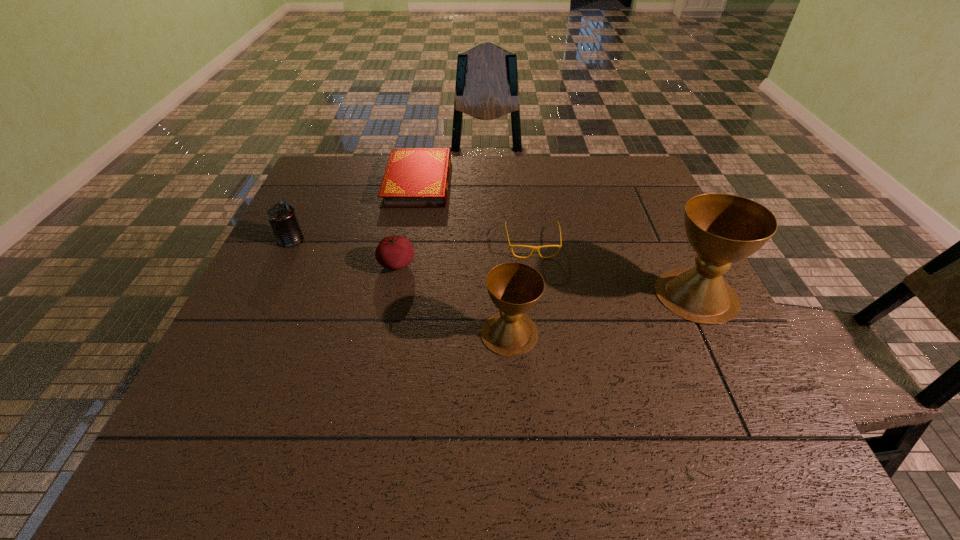
Image resolution: width=960 pixels, height=540 pixels. In the image, there is a desktop. What are the coordinates of `vacant space at the right edge` in the screenshot? It's located at (643, 220).

Find the location of `free location at the far left corner`. free location at the far left corner is located at coordinates (343, 166).

This screenshot has height=540, width=960. I want to click on vacant region at the near left corner of the desktop, so click(x=198, y=389).

Locate an element on the screen. This screenshot has width=960, height=540. vacant space at the far right corner of the desktop is located at coordinates (612, 159).

Image resolution: width=960 pixels, height=540 pixels. What are the coordinates of `free space between the fifth shortest object and the farthest object` in the screenshot? It's located at (464, 258).

You are a GUI agent. You are given a task and a screenshot of the screen. Output one action in this format:
    pyautogui.click(x=<x>, y=<y>)
    Task: Click on the empty space between the tallest object and the farthest object
    Image resolution: width=960 pixels, height=540 pixels.
    Given the screenshot: What is the action you would take?
    pyautogui.click(x=557, y=239)

At what (x,y) coordinates should I click in order to perform the action: click on vacant region between the leftmost object and the shorter chalice. Please return your answer as a coordinate pair (x, y). The height and width of the screenshot is (540, 960). Looking at the image, I should click on (400, 286).

This screenshot has width=960, height=540. Find the location of `free space between the spectacles and the leftmost object`. free space between the spectacles and the leftmost object is located at coordinates (412, 242).

Locate an element on the screen. free area in between the can and the farthest object is located at coordinates (354, 211).

Locate an element on the screen. The width and height of the screenshot is (960, 540). vacant space in between the tallest object and the fourth tallest object is located at coordinates (546, 280).